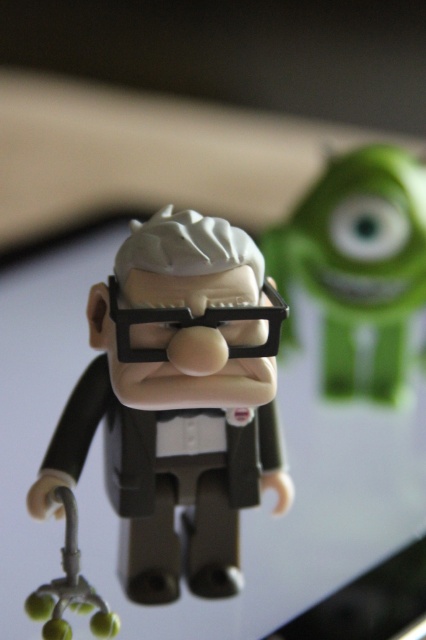
Question: Which point is closer to the camera taking this photo?

Choices:
 (A) (399, 340)
 (B) (244, 403)

Answer: (B)

Question: From the image, what is the correct spatial relationship of matte black figure at center in relation to green matte mike wazowski at upper right?

Choices:
 (A) left
 (B) right

Answer: (A)

Question: Which of the following is the closest to the observer?

Choices:
 (A) (238, 536)
 (B) (322, 362)

Answer: (A)

Question: Is the position of matte black figure at center more distant than that of green matte mike wazowski at upper right?

Choices:
 (A) no
 (B) yes

Answer: (A)

Question: Can you confirm if matte black figure at center is thinner than green matte mike wazowski at upper right?

Choices:
 (A) no
 (B) yes

Answer: (A)

Question: Which point is farther to the camera?

Choices:
 (A) matte black figure at center
 (B) green matte mike wazowski at upper right

Answer: (B)